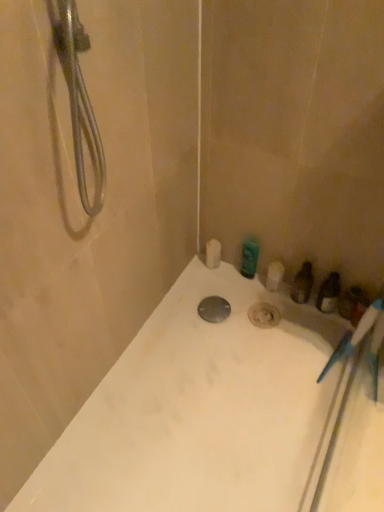
What are the coordinates of `vacant space in front of green glossy bottle at upper right, which is counted as the 1th toiletry, starting from the left` in the screenshot? It's located at (231, 301).